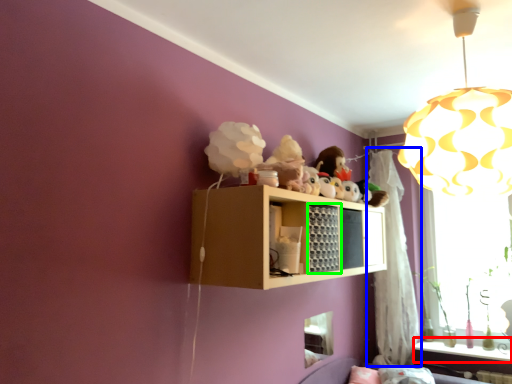
Question: Considering the real-world distances, which object is farthest from window sill (highlighted by a red box)? curtain (highlighted by a blue box) or cabinet (highlighted by a green box)?

Choices:
 (A) curtain
 (B) cabinet

Answer: (B)